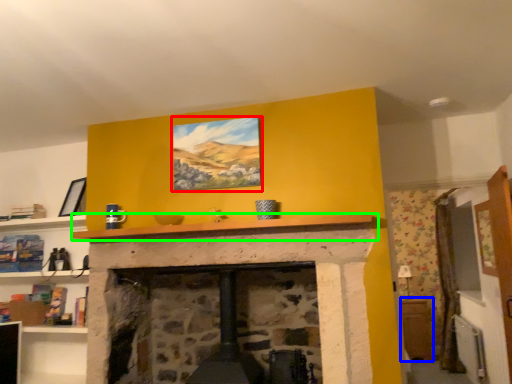
Question: Considering the real-world distances, which object is farthest from picture frame (highlighted by a red box)? table (highlighted by a blue box) or mantle (highlighted by a green box)?

Choices:
 (A) table
 (B) mantle

Answer: (A)